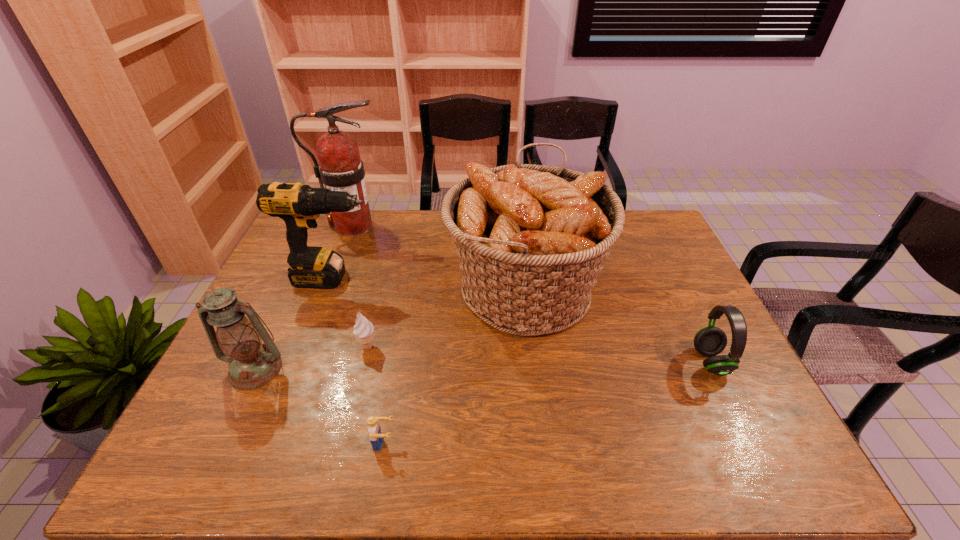
You are a GUI agent. You are given a task and a screenshot of the screen. Output one action in this format:
    pyautogui.click(x=<x>, y=<y>)
    Task: Click on the vacant region at the far left corner
    This screenshot has height=540, width=960.
    Given the screenshot: What is the action you would take?
    pyautogui.click(x=324, y=230)

The height and width of the screenshot is (540, 960). Identify the location of free space at the near left corner. (201, 440).

Where is `vacant space at the far right corner`? This screenshot has width=960, height=540. vacant space at the far right corner is located at coordinates (670, 241).

I want to click on unoccupied position between the drill and the icecream, so click(x=350, y=313).

I want to click on vacant point located between the drill and the sixth object from left to right, so click(x=429, y=283).

The image size is (960, 540). What are the coordinates of `vacant space that is in between the fire extinguisher and the drill` in the screenshot? It's located at (343, 252).

Find the location of `vacant region between the sixth tallest object and the tallest object`. vacant region between the sixth tallest object and the tallest object is located at coordinates (361, 286).

The height and width of the screenshot is (540, 960). I want to click on free spot between the oil lamp and the drill, so [295, 323].

You are a GUI agent. You are given a task and a screenshot of the screen. Output one action in this format:
    pyautogui.click(x=<x>, y=<y>)
    Task: Click on the free spot between the drill and the Lego
    
    Given the screenshot: What is the action you would take?
    pyautogui.click(x=359, y=361)

This screenshot has height=540, width=960. I want to click on free space between the second shortest object and the Lego, so click(x=376, y=395).